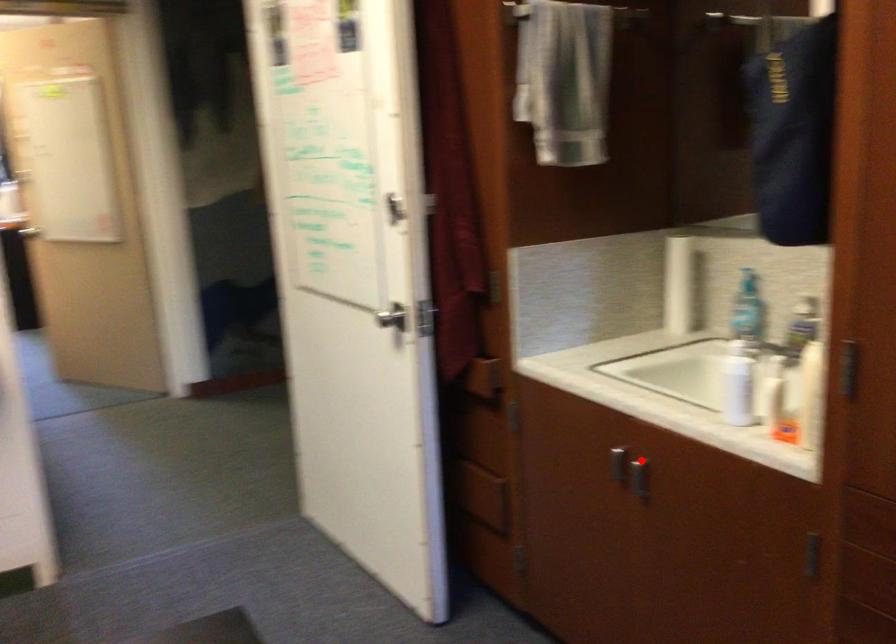
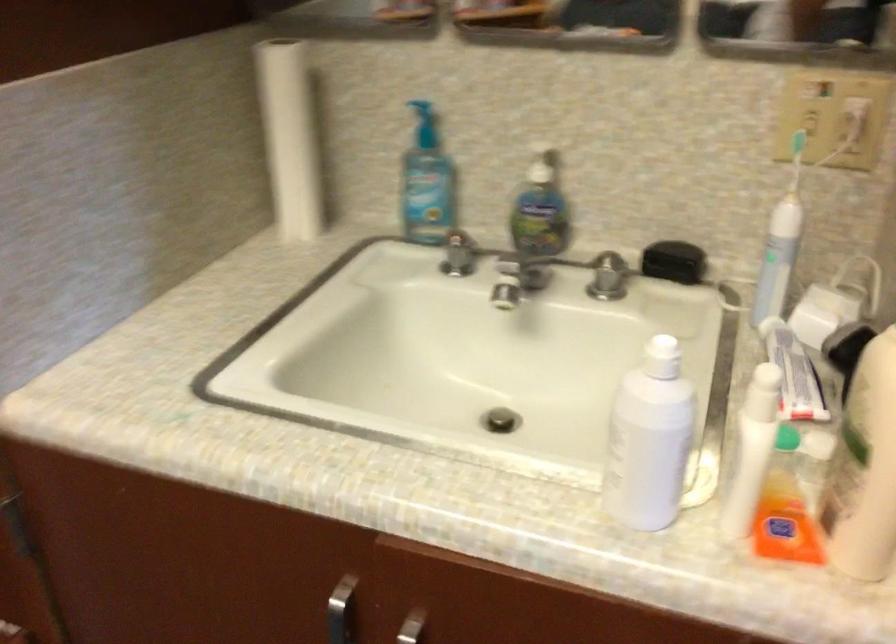
Question: A red point is marked in image1. In image2, is the corresponding 3D point closer to the camera or farther? Reply with the corresponding letter.

Choices:
 (A) The corresponding 3D point is closer.
 (B) The corresponding 3D point is farther.

Answer: (A)